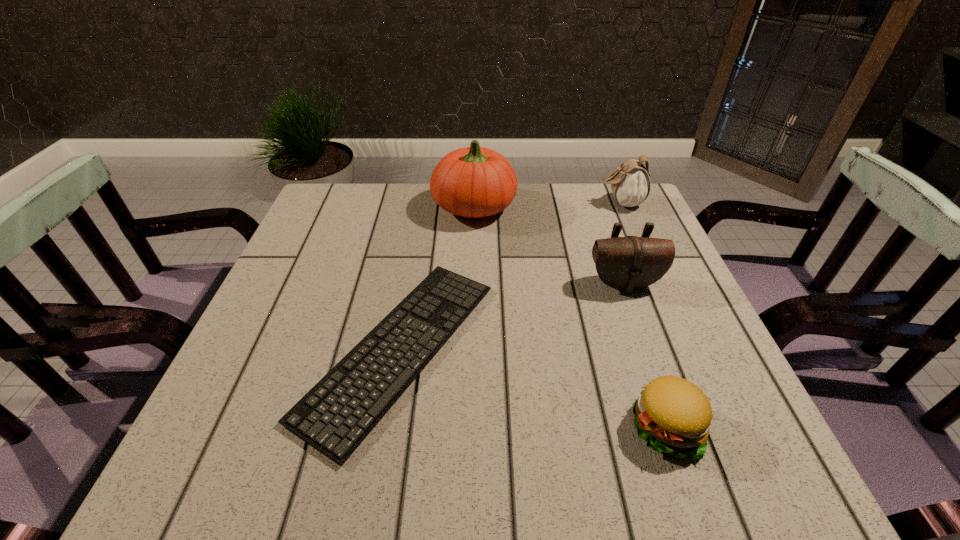
Identify the location of vacant area that lies between the pumpkin and the farther pouch. Image resolution: width=960 pixels, height=540 pixels. (547, 205).

You are a GUI agent. You are given a task and a screenshot of the screen. Output one action in this format:
    pyautogui.click(x=<x>, y=<y>)
    Task: Click on the free space between the farther pouch and the pumpkin
    The height and width of the screenshot is (540, 960).
    Given the screenshot: What is the action you would take?
    pyautogui.click(x=547, y=205)

You are a GUI agent. You are given a task and a screenshot of the screen. Output one action in this format:
    pyautogui.click(x=<x>, y=<y>)
    Task: Click on the vacant area between the computer keyboard and the nearer pouch
    This screenshot has height=540, width=960.
    Given the screenshot: What is the action you would take?
    pyautogui.click(x=512, y=316)

Locate an element on the screen. object that ranks as the second closest to the farther pouch is located at coordinates (630, 263).

Identify which object is the second nearest to the tallest object. Please provide its 2D coordinates. Your answer should be formatted as a tuple, i.e. [(x, y)], where the tuple contains the x and y coordinates of a point satisfying the conditions above.

[(630, 263)]

I want to click on blank space that satisfies the following two spatial constraints: 1. on the front side of the fourth tallest object; 2. on the left side of the tallest object, so tap(469, 426).

Where is `vacant space that satisfies the following two spatial constraints: 1. on the front-facing side of the farther pouch; 2. on the front side of the shortest object`? vacant space that satisfies the following two spatial constraints: 1. on the front-facing side of the farther pouch; 2. on the front side of the shortest object is located at coordinates 684,349.